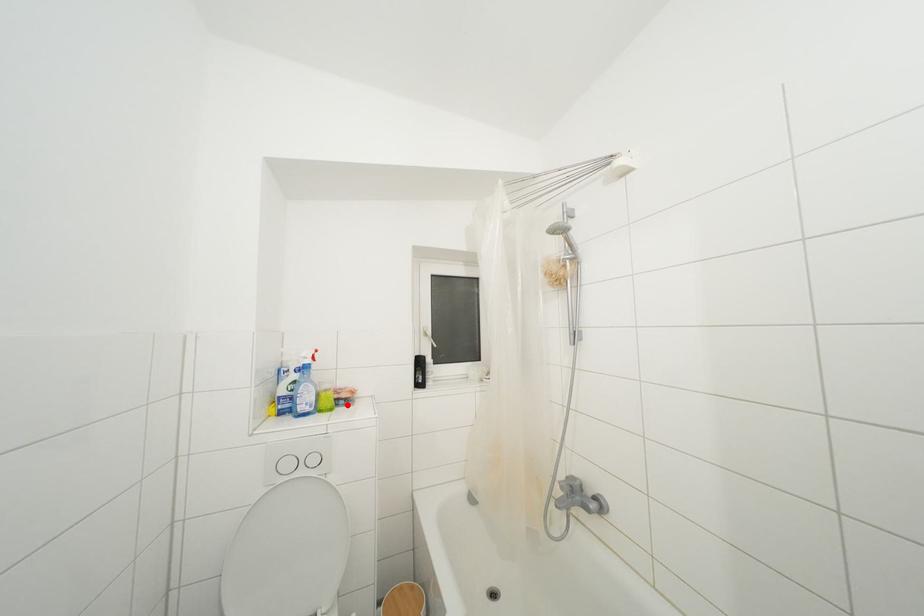
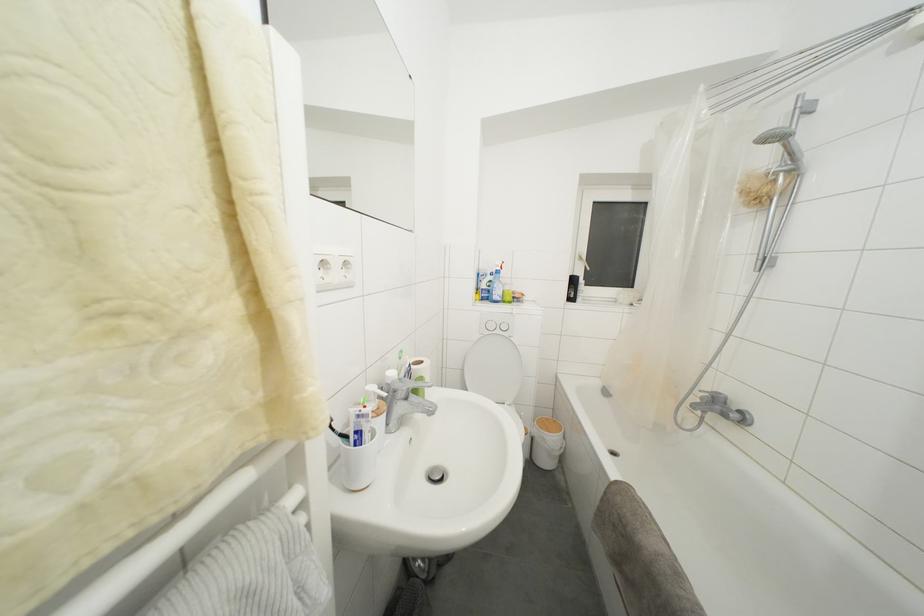
Where in the second image is the point corresponding to the highlighted location from the first image?

(520, 304)